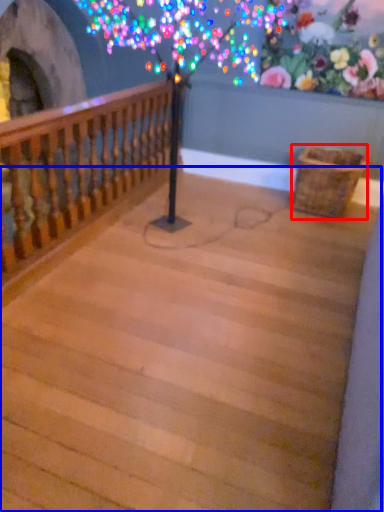
Question: Which object is closer to the camera taking this photo, basket (highlighted by a red box) or stairwell (highlighted by a blue box)?

Choices:
 (A) basket
 (B) stairwell

Answer: (B)